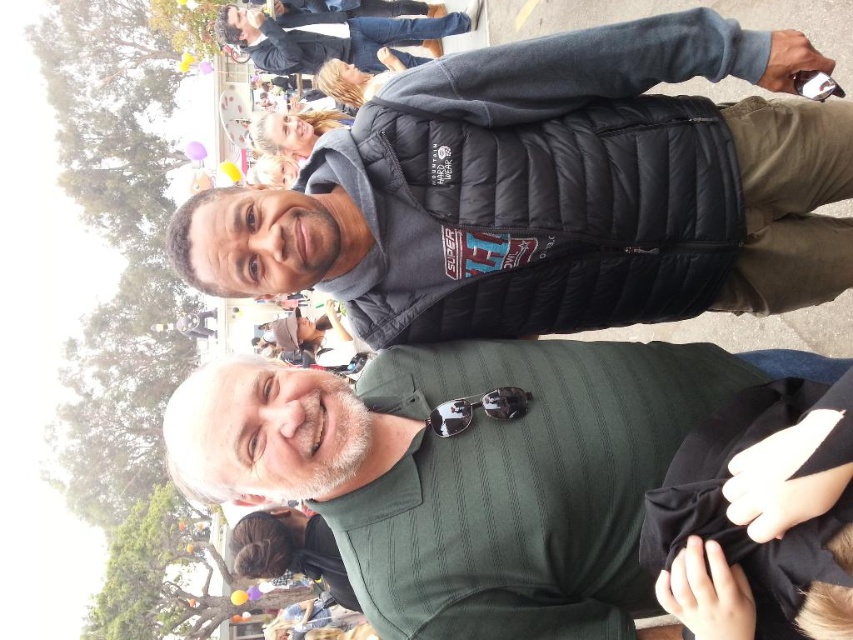
Consider the image. You are a photographer trying to capture a group photo of the two people wearing the dark gray puffer vest at upper center and the black quilted jacket at upper center. If you want to ensure both individuals are fully visible in the frame, which one should you position closer to the center of the camera to avoid cropping?

The dark gray puffer vest at upper center might be wider than the black quilted jacket at upper center, so positioning the person in the dark gray puffer vest at upper center closer to the center of the camera would help ensure both are fully visible without cropping.

You are at an outdoor event and see two people in the foreground. One is wearing a dark gray puffer vest at upper center and the other is wearing a black quilted jacket at upper center. Which of these two items is positioned lower in the image?

The dark gray puffer vest at upper center is positioned lower than the black quilted jacket at upper center in the image.